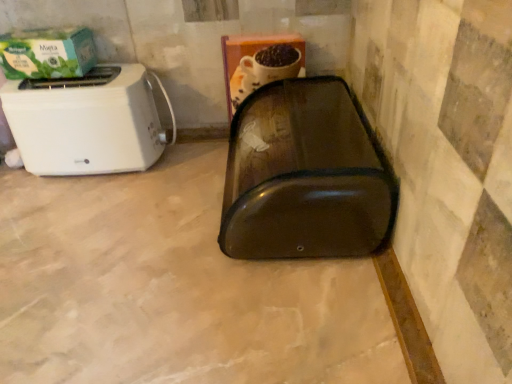
Image resolution: width=512 pixels, height=384 pixels. What do you see at coordinates (88, 121) in the screenshot? I see `white plastic toaster at left` at bounding box center [88, 121].

This screenshot has width=512, height=384. Describe the element at coordinates (305, 176) in the screenshot. I see `transparent plastic bread bin at center` at that location.

Find the location of a particular element. This screenshot has width=512, height=384. white plastic toaster at left is located at coordinates (88, 121).

Is transparent plastic bread bin at center wider than green matte box at upper left?

Yes, transparent plastic bread bin at center is wider than green matte box at upper left.

Based on the photo, from a real-world perspective, is transparent plastic bread bin at center physically below green matte box at upper left?

Indeed, from a real-world perspective, transparent plastic bread bin at center is positioned beneath green matte box at upper left.

Is transparent plastic bread bin at center facing towards green matte box at upper left?

No, transparent plastic bread bin at center is not aimed at green matte box at upper left.

Is the depth of transparent plastic bread bin at center less than that of green matte box at upper left?

Yes, it is in front of green matte box at upper left.

Based on the photo, can you tell me how much transparent plastic bread bin at center and green matte box at upper left differ in facing direction?

90 degrees separate the facing orientations of transparent plastic bread bin at center and green matte box at upper left.

The height and width of the screenshot is (384, 512). In order to click on box behind the transparent plastic bread bin at center in this screenshot , I will do `click(47, 53)`.

Can you confirm if transparent plastic bread bin at center is shorter than green matte box at upper left?

Incorrect, the height of transparent plastic bread bin at center does not fall short of that of green matte box at upper left.

Can we say white plastic toaster at left lies outside transparent plastic bread bin at center?

Indeed, white plastic toaster at left is completely outside transparent plastic bread bin at center.

Is white plastic toaster at left not near transparent plastic bread bin at center?

No, white plastic toaster at left is in close proximity to transparent plastic bread bin at center.

Does white plastic toaster at left appear on the right side of transparent plastic bread bin at center?

Correct, you'll find white plastic toaster at left to the right of transparent plastic bread bin at center.

Is white plastic toaster at left positioned with its back to transparent plastic bread bin at center?

white plastic toaster at left does not have its back to transparent plastic bread bin at center.

From the image's perspective, between transparent plastic bread bin at center and white plastic toaster at left, which one is located above?

white plastic toaster at left is shown above in the image.

Looking at their sizes, would you say transparent plastic bread bin at center is wider or thinner than white plastic toaster at left?

transparent plastic bread bin at center is wider than white plastic toaster at left.

From a real-world perspective, is transparent plastic bread bin at center positioned over white plastic toaster at left based on gravity?

Incorrect, from a real-world perspective, transparent plastic bread bin at center is lower than white plastic toaster at left.

Considering the positions of point (16, 129) and point (52, 62), is point (16, 129) closer or farther from the camera than point (52, 62)?

Point (16, 129).

Is white plastic toaster at left turned away from green matte box at upper left?

No, white plastic toaster at left is not facing away from green matte box at upper left.

Based on the photo, what's the angular difference between white plastic toaster at left and green matte box at upper left's facing directions?

white plastic toaster at left and green matte box at upper left are facing 0.00064 degrees away from each other.

Locate an element on the screen. The height and width of the screenshot is (384, 512). box on the left of white plastic toaster at left is located at coordinates (47, 53).

From the image's perspective, is green matte box at upper left above or below transparent plastic bread bin at center?

From the image's perspective, green matte box at upper left appears above transparent plastic bread bin at center.

Based on the photo, is green matte box at upper left completely or partially outside of transparent plastic bread bin at center?

green matte box at upper left is positioned outside transparent plastic bread bin at center.

Considering the relative positions of green matte box at upper left and transparent plastic bread bin at center in the image provided, is green matte box at upper left to the left or to the right of transparent plastic bread bin at center?

green matte box at upper left is positioned on transparent plastic bread bin at center's left side.

Which object is thinner, green matte box at upper left or white plastic toaster at left?

green matte box at upper left.

Consider the image. Between green matte box at upper left and white plastic toaster at left, which one appears on the right side from the viewer's perspective?

white plastic toaster at left is more to the right.

Consider the image. Between green matte box at upper left and white plastic toaster at left, which one has less height?

With less height is green matte box at upper left.

In the scene shown: From the image's perspective, is green matte box at upper left positioned above or below white plastic toaster at left?

green matte box at upper left is above white plastic toaster at left.

The image size is (512, 384). I want to click on concrete on the right of green matte box at upper left, so click(172, 288).

Where is `appliance below the green matte box at upper left (from the image's perspective)`? The image size is (512, 384). appliance below the green matte box at upper left (from the image's perspective) is located at coordinates (305, 176).

Looking at the image, which one is located closer to white plastic toaster at left, green matte box at upper left or transparent plastic bread bin at center?

Based on the image, green matte box at upper left appears to be nearer to white plastic toaster at left.

From the image, which object appears to be farther from green matte box at upper left, white plastic toaster at left or transparent plastic bread bin at center?

transparent plastic bread bin at center.

Considering their positions, is green matte box at upper left positioned closer to transparent plastic bread bin at center than white plastic toaster at left?

white plastic toaster at left is closer to transparent plastic bread bin at center.

Which object lies further to the anchor point transparent plastic bread bin at center, green matte box at upper left or transparent plastic bread bin at center?

green matte box at upper left is positioned further to the anchor transparent plastic bread bin at center.

From the image, which object appears to be farther from green matte box at upper left, white plastic toaster at left or transparent plastic bread bin at center?

Among the two, transparent plastic bread bin at center is located further to green matte box at upper left.

Estimate the real-world distances between objects in this image. Which object is further from transparent plastic bread bin at center, green matte box at upper left or white plastic toaster at left?

green matte box at upper left lies further to transparent plastic bread bin at center than the other object.

Considering their positions, is transparent plastic bread bin at center positioned further to white plastic toaster at left than transparent plastic bread bin at center?

Among the two, transparent plastic bread bin at center is located further to white plastic toaster at left.

Considering their positions, is transparent plastic bread bin at center positioned further to transparent plastic bread bin at center than green matte box at upper left?

green matte box at upper left lies further to transparent plastic bread bin at center than the other object.

Identify the location of toaster between green matte box at upper left and transparent plastic bread bin at center in the up-down direction. This screenshot has height=384, width=512. (88, 121).

Where is `toaster between green matte box at upper left and transparent plastic bread bin at center`? The height and width of the screenshot is (384, 512). toaster between green matte box at upper left and transparent plastic bread bin at center is located at coordinates (88, 121).

Identify the location of appliance between white plastic toaster at left and transparent plastic bread bin at center in the up-down direction. (305, 176).

This screenshot has height=384, width=512. What are the coordinates of `appliance that lies between green matte box at upper left and transparent plastic bread bin at center from top to bottom` in the screenshot? It's located at (305, 176).